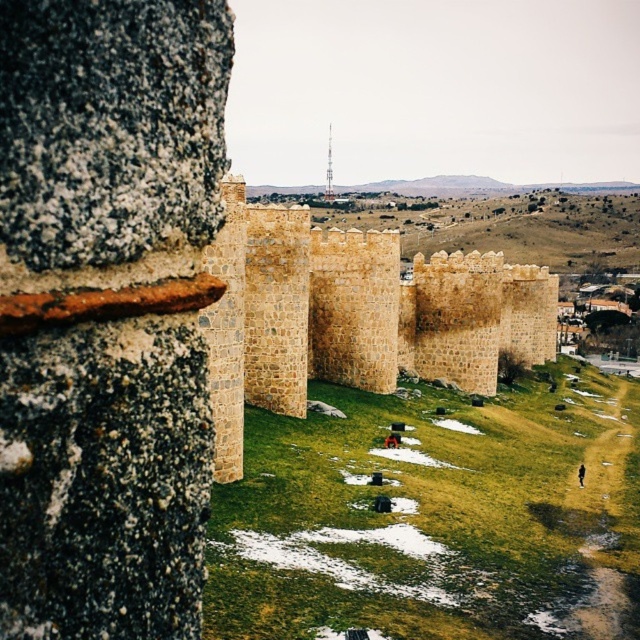
You are an architect inspecting the historic site. You need to place a new sculpture exactly between the brown stone wall at center and the smooth concrete tower at center. Which object should the sculpture be closer to, and why?

The sculpture should be closer to the smooth concrete tower at center because the brown stone wall at center is larger in size than the smooth concrete tower at center, making the tower the smaller of the two. The midpoint between them would naturally be closer to the smaller object.

You are standing in front of the historic stone wall and notice two points marked on the wall. The first point is at coordinates point [209,250] and the second is at point [328,131]. From your perspective, which point appears closer to you?

Point [209,250] is in front of point [328,131], so it appears closer to you.

You are an archaeologist examining the historic site. You notice the brown stone wall at center and the smooth concrete tower at center. Which structure is closer to you based on their positions?

The brown stone wall at center is closer because it is in front of the smooth concrete tower at center.